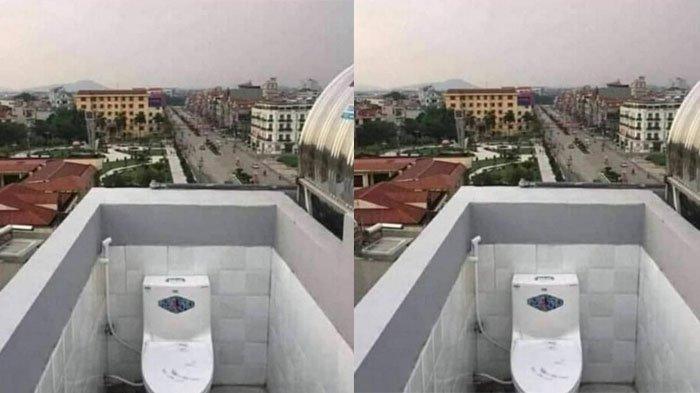
Where is `grey top of wall`? The width and height of the screenshot is (700, 393). grey top of wall is located at coordinates (157, 211), (550, 226).